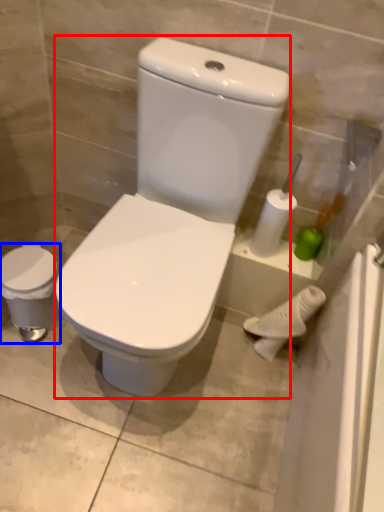
Question: Which object appears farthest to the camera in this image, porcelain (highlighted by a red box) or porcelain (highlighted by a blue box)?

Choices:
 (A) porcelain
 (B) porcelain

Answer: (B)